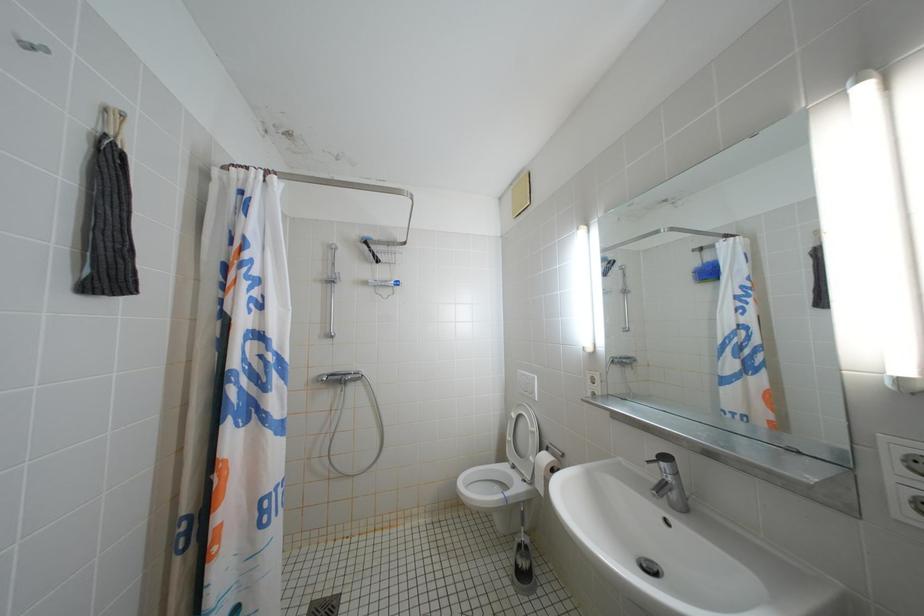
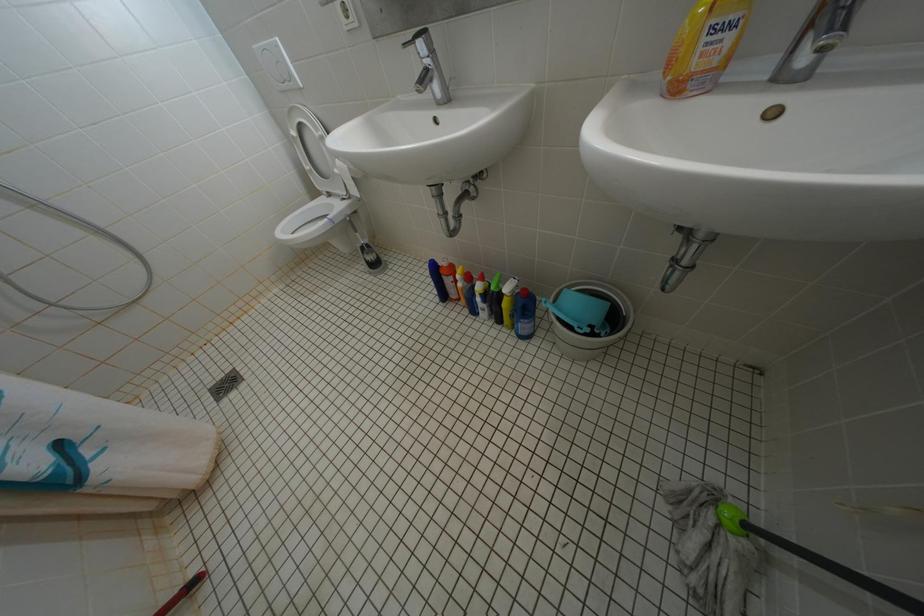
The first image is from the beginning of the video and the second image is from the end. How did the camera likely rotate when shooting the video?

The camera rotated toward right-down.